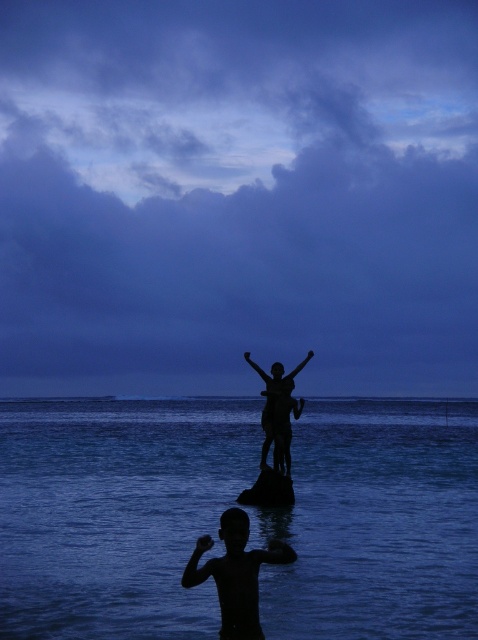
Question: Observing the image, what is the correct spatial positioning of black skin boy at lower center in reference to silhouette statue at center?

Choices:
 (A) above
 (B) below

Answer: (B)

Question: From the image, what is the correct spatial relationship of dark blue water at center in relation to silhouette statue at center?

Choices:
 (A) above
 (B) below

Answer: (B)

Question: Which of the following is the farthest from the observer?

Choices:
 (A) black skin boy at lower center
 (B) dark blue water at center
 (C) silhouette statue at center

Answer: (C)

Question: Which point is farther to the camera?

Choices:
 (A) black skin boy at lower center
 (B) dark blue water at center
 (C) silhouette statue at center

Answer: (C)

Question: Which is nearer to the black skin boy at lower center?

Choices:
 (A) silhouette statue at center
 (B) dark blue water at center

Answer: (A)

Question: Does black skin boy at lower center appear over silhouette statue at center?

Choices:
 (A) no
 (B) yes

Answer: (A)